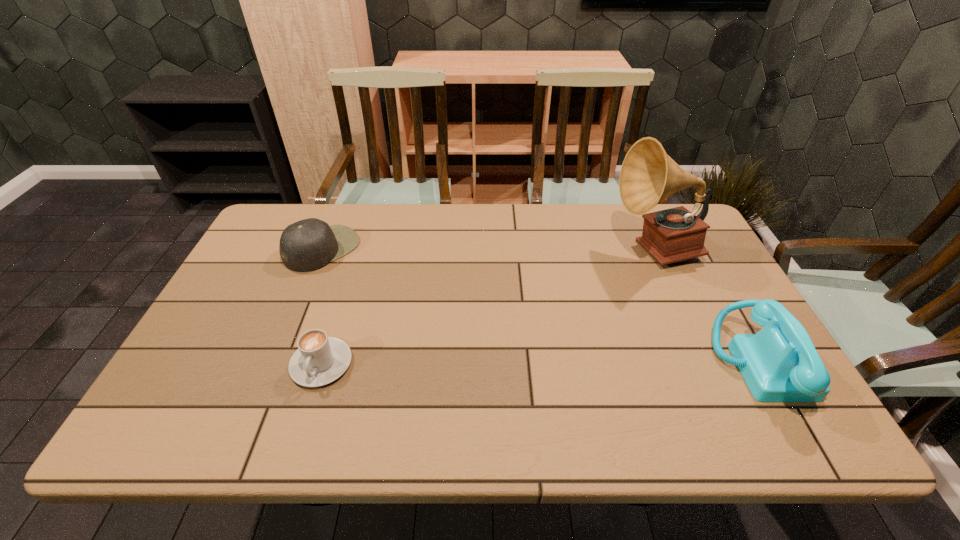
This screenshot has width=960, height=540. In order to click on blank space that satisfies the following two spatial constraints: 1. on the front side of the phonograph record; 2. on the right side of the second shortest object in this screenshot , I will do `click(323, 251)`.